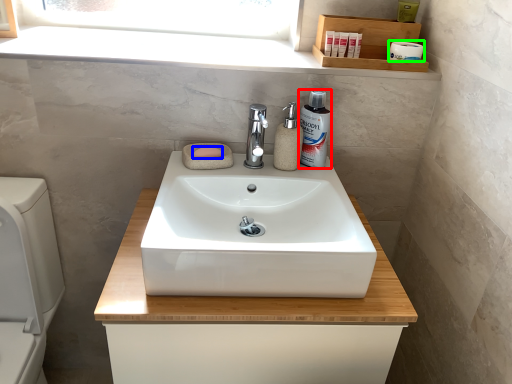
Question: Considering the real-world distances, which object is closest to mouthwash (highlighted by a red box)? soap (highlighted by a blue box) or toilet paper (highlighted by a green box).

Choices:
 (A) soap
 (B) toilet paper

Answer: (A)